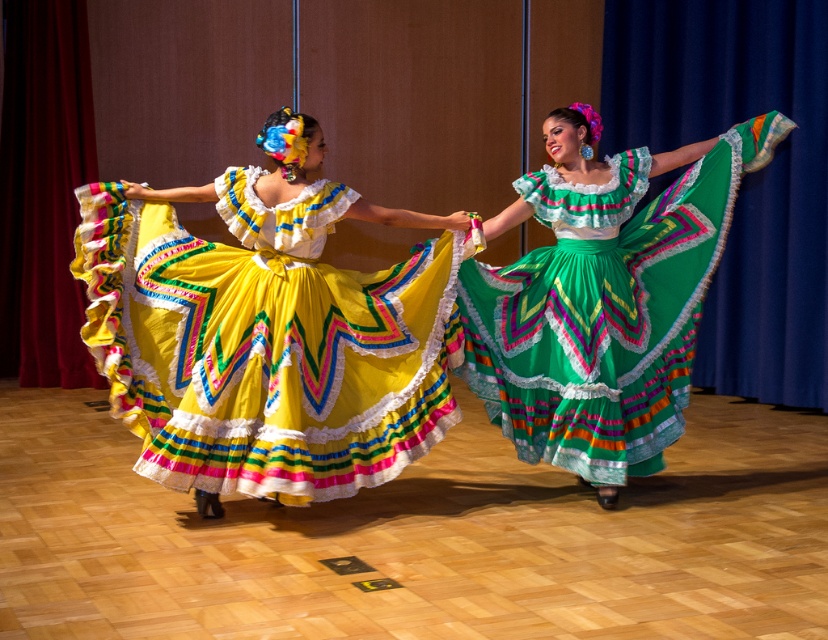
Question: Can you confirm if matte yellow dress at center is wider than green satin skirt at center?

Choices:
 (A) yes
 (B) no

Answer: (A)

Question: Can you confirm if matte yellow dress at center is positioned above green satin skirt at center?

Choices:
 (A) yes
 (B) no

Answer: (B)

Question: Which point appears farthest from the camera in this image?

Choices:
 (A) (297, 320)
 (B) (681, 310)

Answer: (B)

Question: Is matte yellow dress at center thinner than green satin skirt at center?

Choices:
 (A) no
 (B) yes

Answer: (A)

Question: Which point is farther to the camera?

Choices:
 (A) (360, 470)
 (B) (687, 310)

Answer: (B)

Question: Which point is farther to the camera?

Choices:
 (A) [152, 397]
 (B) [499, 349]

Answer: (B)